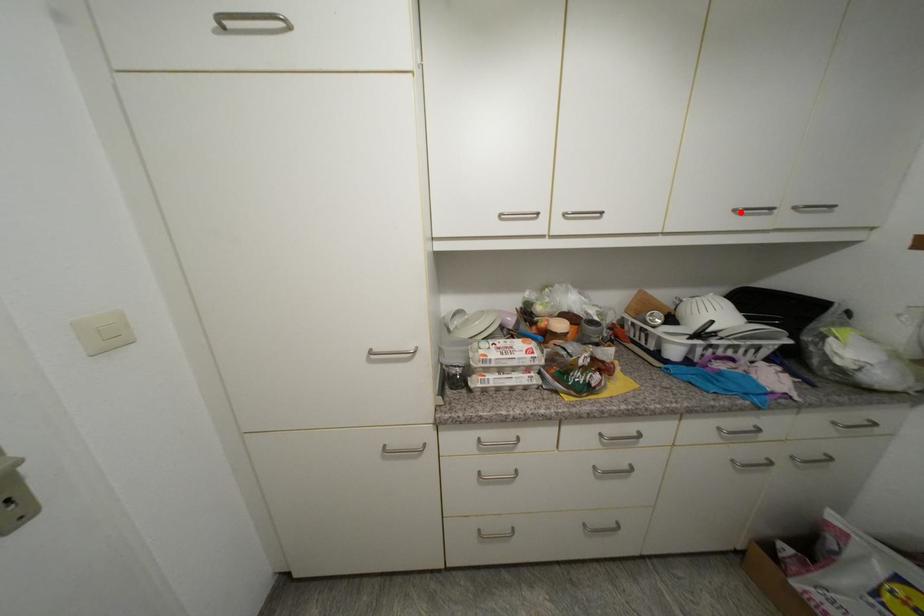
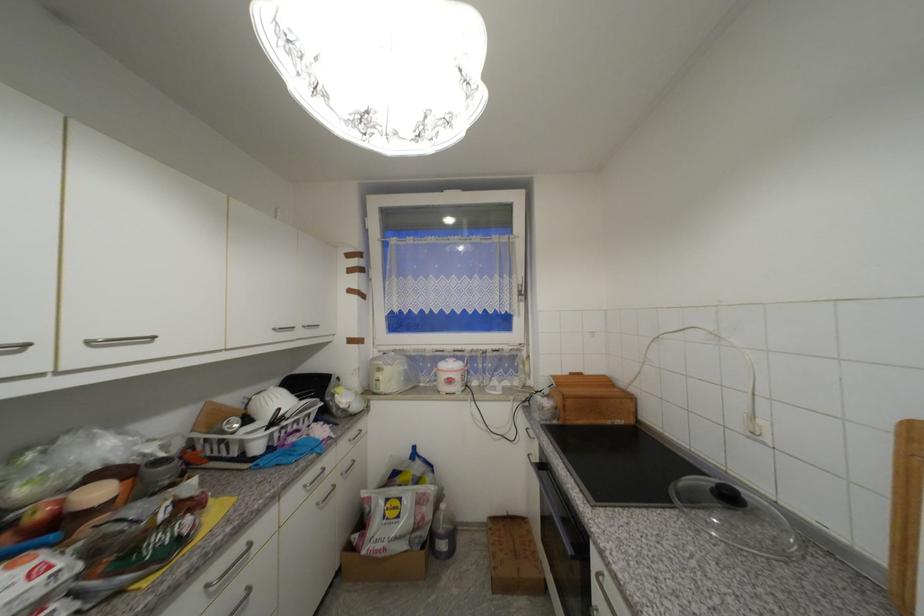
Where in the second image is the point corresponding to the highlighted location from the first image?

(281, 331)